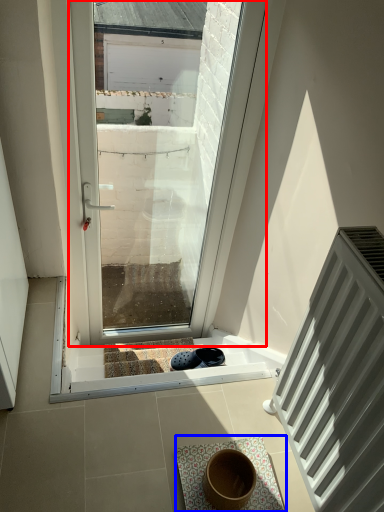
Question: Which object appears closest to the camera in this image, window (highlighted by a red box) or bath mat (highlighted by a blue box)?

Choices:
 (A) window
 (B) bath mat

Answer: (B)